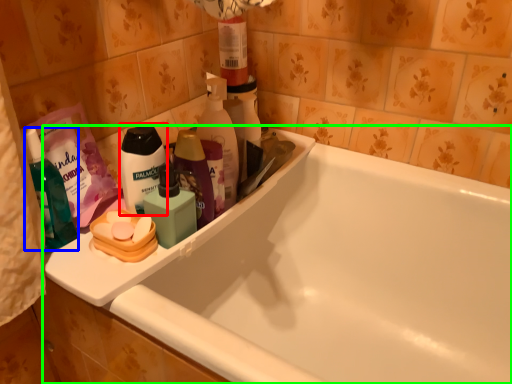
Question: Which object is positioned farthest from personal care (highlighted by a red box)? Select from toiletry (highlighted by a blue box) and bathtub (highlighted by a green box).

Choices:
 (A) toiletry
 (B) bathtub

Answer: (B)